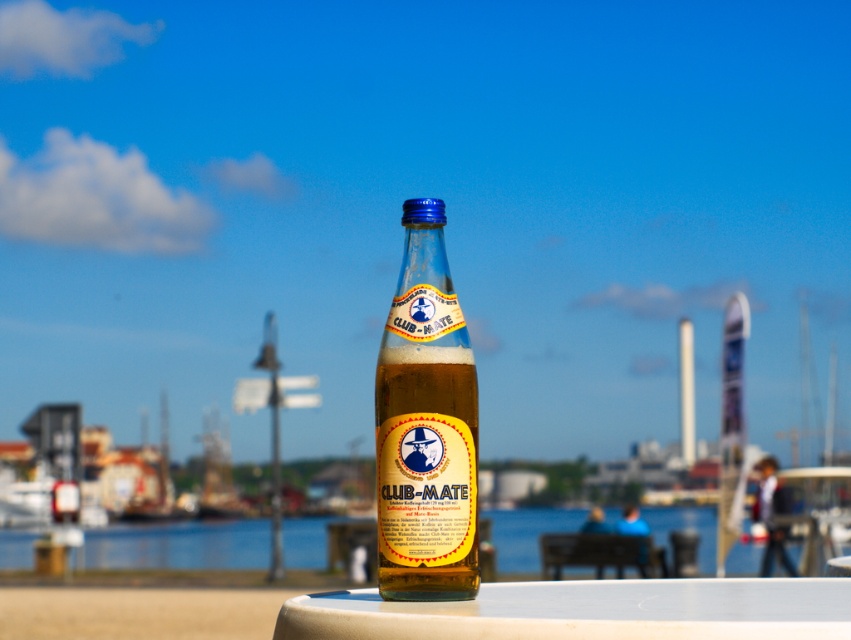
Between point (400, 468) and point (390, 634), which one is positioned in front?

Point (390, 634)

The image size is (851, 640). Find the location of `translucent glass bottle at center`. translucent glass bottle at center is located at coordinates (426, 426).

The height and width of the screenshot is (640, 851). What are the coordinates of `white plastic table at center` in the screenshot? It's located at (x=585, y=611).

Does point (609, 596) lie behind point (700, 563)?

No, (609, 596) is closer to viewer.

Which is behind, point (358, 628) or point (106, 540)?

Point (106, 540)

Identify the location of white plastic table at center. This screenshot has height=640, width=851. (585, 611).

Is point (390, 371) behind point (310, 545)?

No.

The height and width of the screenshot is (640, 851). Describe the element at coordinates (426, 426) in the screenshot. I see `translucent glass bottle at center` at that location.

Which is in front, point (413, 262) or point (789, 547)?

Point (413, 262) is more forward.

Where is `translucent glass bottle at center`? translucent glass bottle at center is located at coordinates (426, 426).